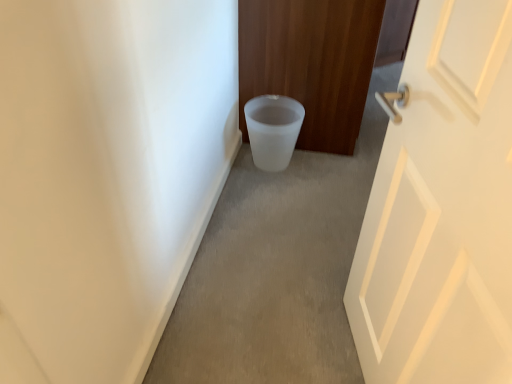
The width and height of the screenshot is (512, 384). Identify the location of white matte door at lower right. (311, 63).

What is the approximate height of white matte door at lower right?

31.40 inches.

Image resolution: width=512 pixels, height=384 pixels. What do you see at coordinates (311, 63) in the screenshot?
I see `white matte door at lower right` at bounding box center [311, 63].

Measure the distance between white matte door at lower right and camera.

white matte door at lower right and camera are 1.70 meters apart from each other.

You are a GUI agent. You are given a task and a screenshot of the screen. Output one action in this format:
    pyautogui.click(x=<x>, y=<y>)
    Task: Click on the white matte door at lower right
    
    Given the screenshot: What is the action you would take?
    coord(311,63)